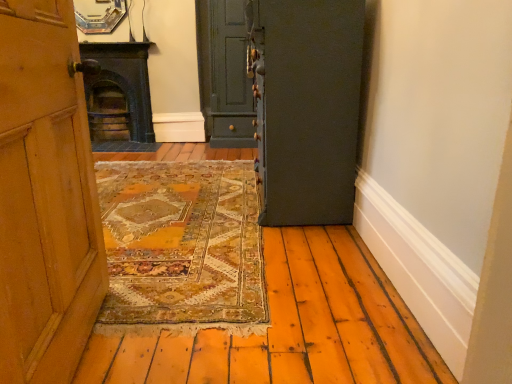
Question: Does dark green stone fireplace at left appear on the right side of dark gray matte door at center, the 2th door viewed from the back?

Choices:
 (A) no
 (B) yes

Answer: (A)

Question: Is dark green stone fireplace at left taller than dark gray matte door at center, the 2th door viewed from the back?

Choices:
 (A) no
 (B) yes

Answer: (A)

Question: Does dark green stone fireplace at left have a larger size compared to dark gray matte door at center, which ranks as the 2th door in left-to-right order?

Choices:
 (A) yes
 (B) no

Answer: (B)

Question: Considering the relative positions of dark green stone fireplace at left and dark gray matte door at center, the 1th door from the front, in the image provided, is dark green stone fireplace at left to the left of dark gray matte door at center, the 1th door from the front, from the viewer's perspective?

Choices:
 (A) no
 (B) yes

Answer: (B)

Question: From the image's perspective, is dark green stone fireplace at left under dark gray matte door at center, the 2th door viewed from the back?

Choices:
 (A) yes
 (B) no

Answer: (B)

Question: From a real-world perspective, is dark green stone fireplace at left on dark gray matte door at center, which appears as the 1th door when viewed from the right?

Choices:
 (A) no
 (B) yes

Answer: (A)

Question: Is dark green stone fireplace at left not inside matte green door at center, marked as the second door in a front-to-back arrangement?

Choices:
 (A) no
 (B) yes

Answer: (B)

Question: Can you confirm if dark green stone fireplace at left is wider than matte green door at center, placed as the second door when sorted from right to left?

Choices:
 (A) no
 (B) yes

Answer: (A)

Question: From a real-world perspective, does dark green stone fireplace at left stand above matte green door at center, placed as the first door when sorted from back to front?

Choices:
 (A) yes
 (B) no

Answer: (B)

Question: Considering the relative sizes of dark green stone fireplace at left and matte green door at center, marked as the second door in a front-to-back arrangement, in the image provided, is dark green stone fireplace at left bigger than matte green door at center, marked as the second door in a front-to-back arrangement,?

Choices:
 (A) yes
 (B) no

Answer: (B)

Question: Is dark green stone fireplace at left beside matte green door at center, placed as the second door when sorted from right to left?

Choices:
 (A) no
 (B) yes

Answer: (A)

Question: From a real-world perspective, is dark green stone fireplace at left beneath matte green door at center, which ranks as the 1th door in left-to-right order?

Choices:
 (A) yes
 (B) no

Answer: (A)

Question: Can you confirm if dark gray matte door at center, which ranks as the 2th door in left-to-right order, is wider than matte green door at center, placed as the first door when sorted from back to front?

Choices:
 (A) no
 (B) yes

Answer: (A)